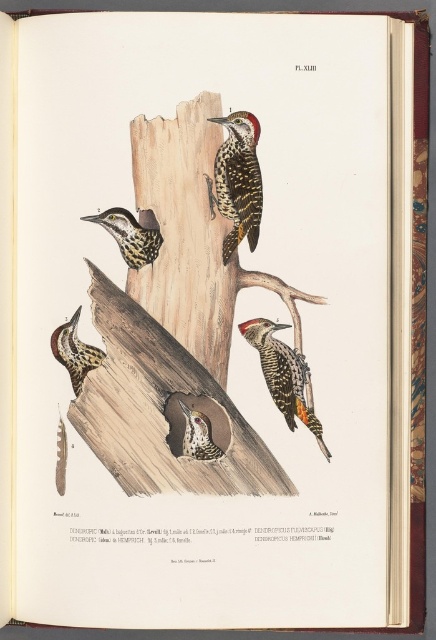
Looking at this image, between yellow-brown speckled woodpecker at lower right and speckled brown woodpecker at lower center, which one is positioned lower?

Positioned lower is speckled brown woodpecker at lower center.

This screenshot has width=436, height=640. I want to click on yellow-brown speckled woodpecker at lower right, so click(282, 374).

Between point (286, 362) and point (204, 449), which one is positioned behind?

The point (204, 449) is more distant.

Find the location of a particular element. yellow-brown speckled woodpecker at lower right is located at coordinates (282, 374).

Is wooden log at upper center positioned at the back of speckled brown woodpecker at lower center?

No, it is not.

Find the location of a particular element. The width and height of the screenshot is (436, 640). wooden log at upper center is located at coordinates (174, 324).

Does wooden log at upper center have a lesser width compared to wooden log at center?

Incorrect, wooden log at upper center's width is not less than wooden log at center's.

The image size is (436, 640). Describe the element at coordinates (174, 324) in the screenshot. I see `wooden log at upper center` at that location.

Identify the location of wooden log at upper center. (174, 324).